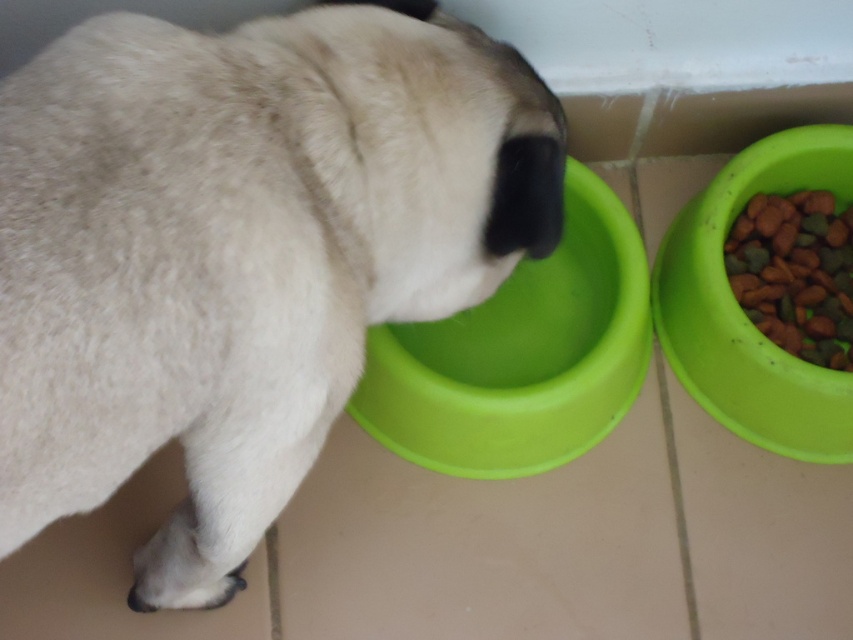
Between green plastic bowl at lower left and green matte kibble at right, which one appears on the left side from the viewer's perspective?

From the viewer's perspective, green plastic bowl at lower left appears more on the left side.

Does green plastic bowl at lower left have a greater height compared to green matte kibble at right?

Yes.

Which is in front, point (410, 392) or point (753, 296)?

Point (410, 392) is more forward.

In order to click on green plastic bowl at lower left in this screenshot , I will do `click(521, 355)`.

Does white matte dog at center have a larger size compared to green plastic bowl at lower left?

Yes, white matte dog at center is bigger than green plastic bowl at lower left.

Is point (213, 406) positioned in front of point (393, 445)?

That is True.

Find the location of a particular element. white matte dog at center is located at coordinates (241, 252).

Does point (735, 387) come closer to viewer compared to point (821, 323)?

That is True.

Who is more forward, (664, 352) or (746, 262)?

Positioned in front is point (746, 262).

Who is more distant from viewer, (786, 355) or (805, 301)?

Positioned behind is point (805, 301).

In order to click on green plastic bowl at right in this screenshot , I will do `click(741, 308)`.